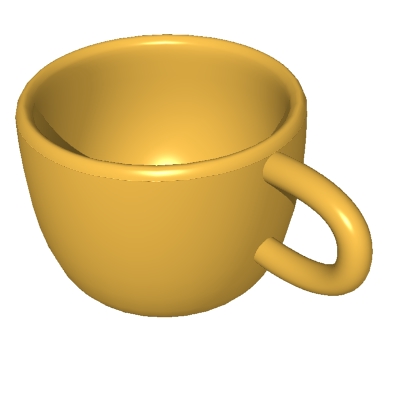
The height and width of the screenshot is (400, 400). In order to click on rim of the cup in this screenshot , I will do `click(191, 172)`.